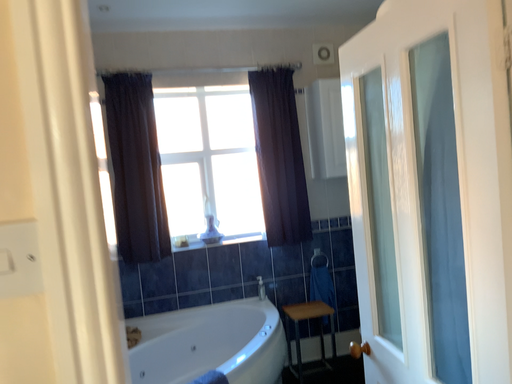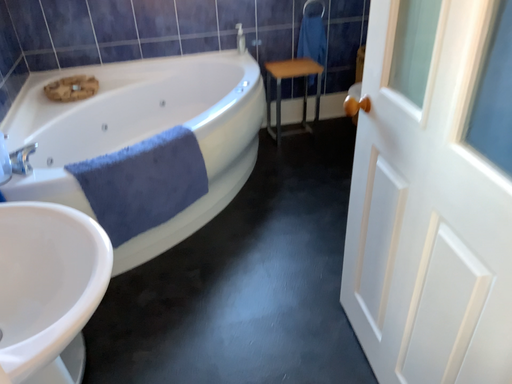
Question: Which way did the camera rotate in the video?

Choices:
 (A) rotated upward
 (B) rotated downward

Answer: (B)